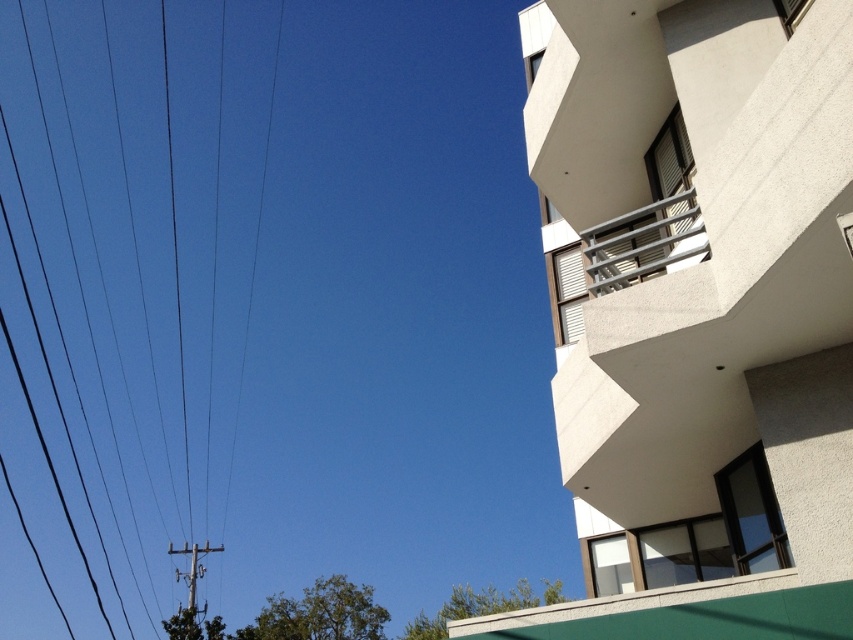
Between black wire at left and metallic gray pole at lower left, which one has less height?

metallic gray pole at lower left

Is black wire at left positioned before metallic gray pole at lower left?

That is False.

Does point (186, 256) come farther from viewer compared to point (190, 598)?

That is True.

Locate an element on the screen. The image size is (853, 640). black wire at left is located at coordinates (183, 232).

Between black wire at left and metallic gray balcony at upper right, which one has more height?

With more height is black wire at left.

Is point (123, 305) positioned behind point (612, 285)?

Yes, it is.

What are the coordinates of `black wire at left` in the screenshot? It's located at (183, 232).

Does metallic gray balcony at upper right appear on the right side of metallic gray pole at lower left?

Yes, metallic gray balcony at upper right is to the right of metallic gray pole at lower left.

Is point (670, 221) positioned behind point (178, 554)?

No, (670, 221) is in front of (178, 554).

Is point (666, 248) positioned behind point (177, 570)?

No, (666, 248) is closer to viewer.

In order to click on metallic gray balcony at upper right in this screenshot , I will do `click(643, 243)`.